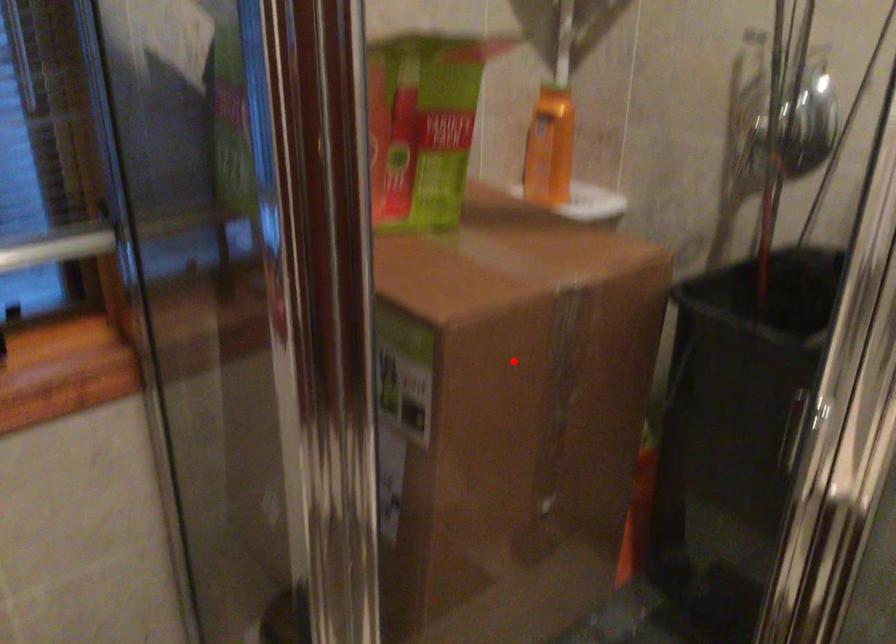
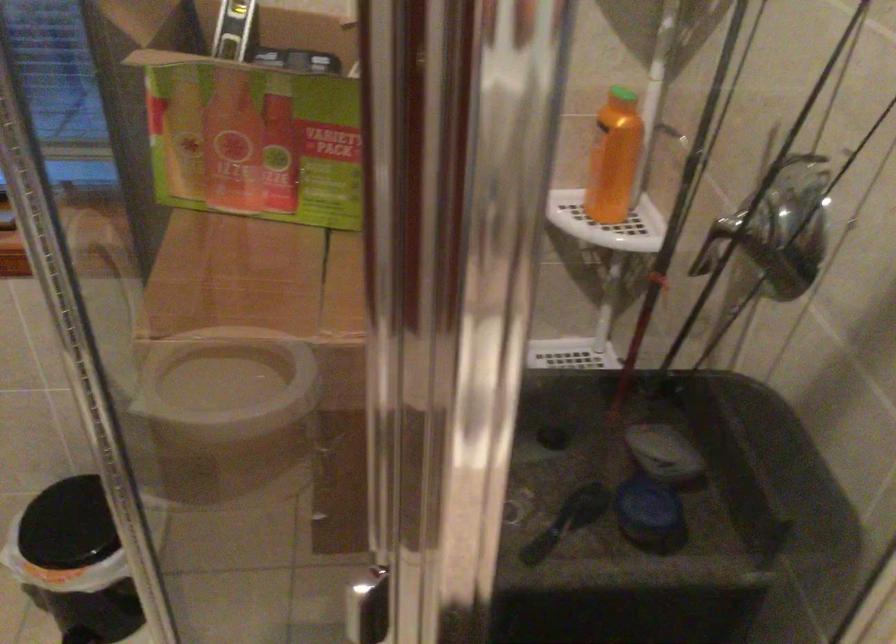
Locate, in the second image, the point that corresponds to the highlighted location in the first image.

(244, 383)